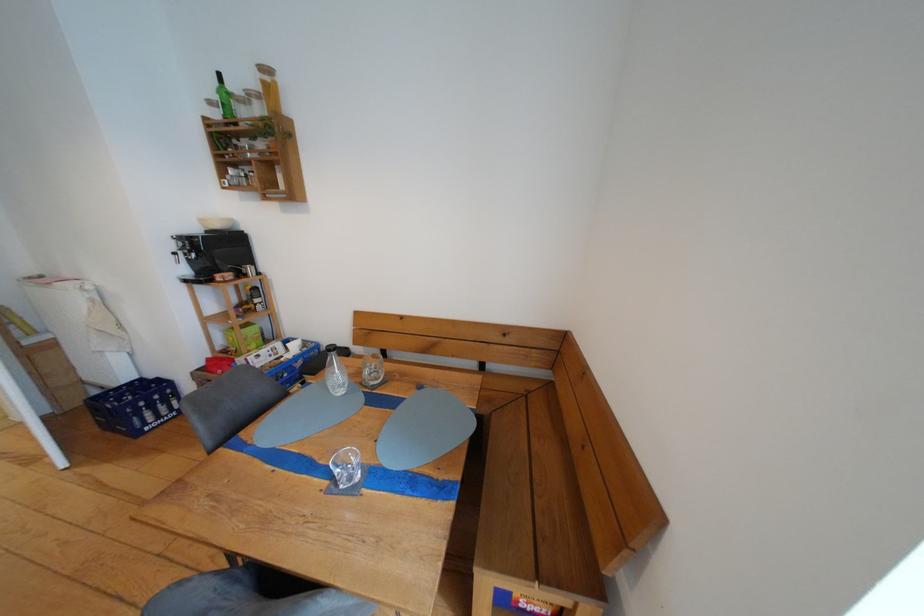
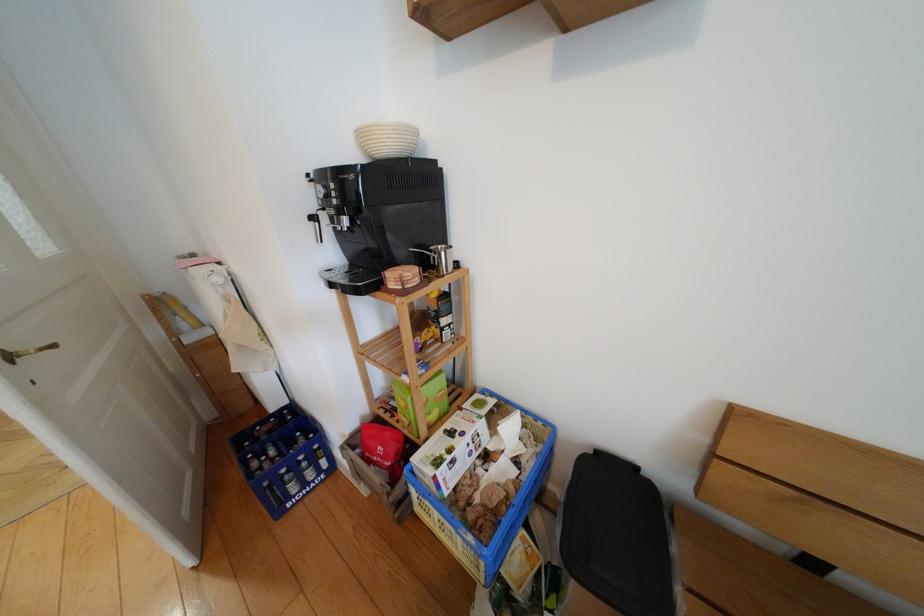
Which direction would the cameraman need to move to produce the second image?

The cameraman walked toward left, forward.